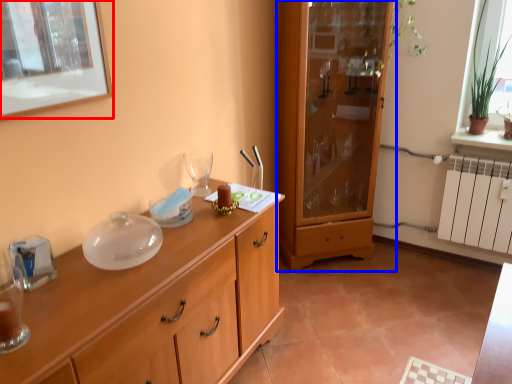
Question: Among these objects, which one is nearest to the camera, picture frame (highlighted by a red box) or cabinetry (highlighted by a blue box)?

Choices:
 (A) picture frame
 (B) cabinetry

Answer: (A)